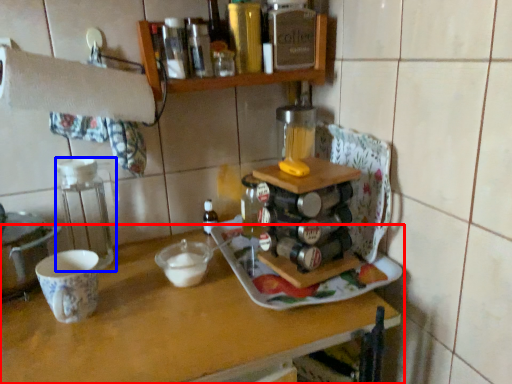
Question: Which object is closer to the camera taking this photo, table (highlighted by a red box) or appliance (highlighted by a blue box)?

Choices:
 (A) table
 (B) appliance

Answer: (A)